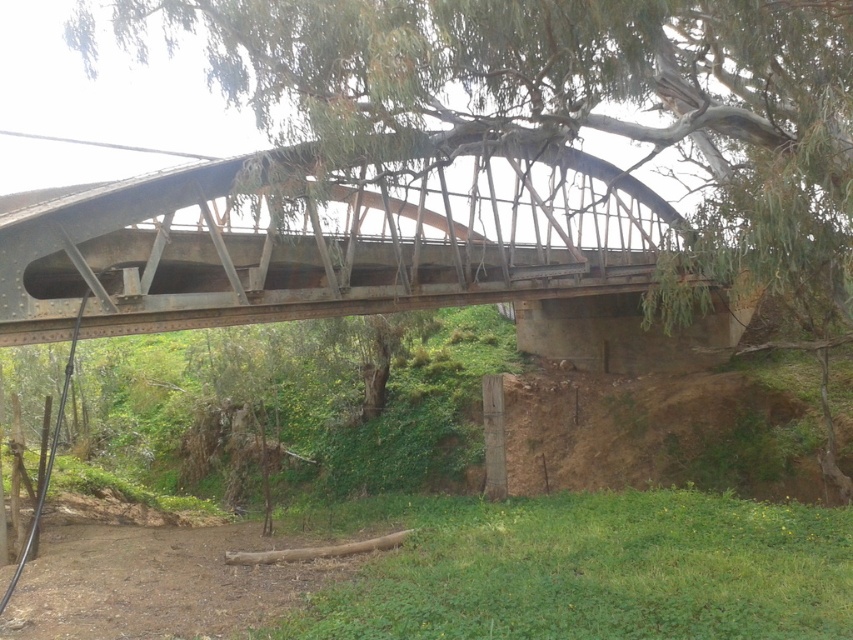
Question: Is green leafy tree at center bigger than rusty metal bridge at center?

Choices:
 (A) yes
 (B) no

Answer: (B)

Question: Is green leafy tree at center closer to camera compared to rusty metal bridge at center?

Choices:
 (A) no
 (B) yes

Answer: (B)

Question: Does green leafy tree at center come behind rusty metal bridge at center?

Choices:
 (A) yes
 (B) no

Answer: (B)

Question: Which of the following is the farthest from the observer?

Choices:
 (A) green leafy tree at center
 (B) rusty metal bridge at center

Answer: (B)